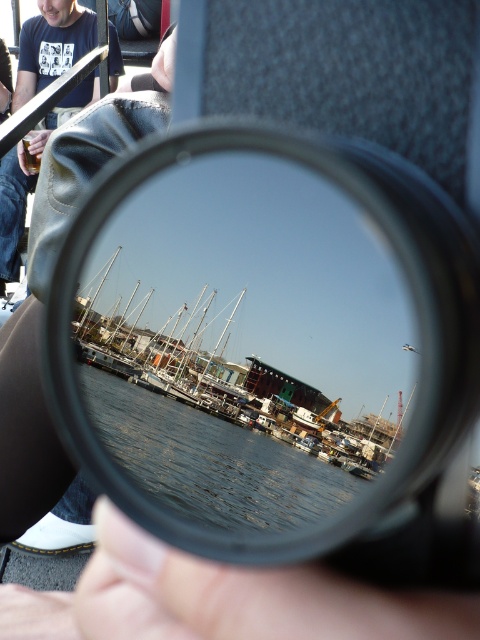
You are a photographer holding a camera with a circular lens. You notice a smooth skin hand at center and a clear water at center in your viewfinder. Which object is closer to the right edge of the circular lens?

The smooth skin hand at center is closer to the right edge of the circular lens because it is positioned to the right of the clear water at center.

You are an observer looking through the transparent plastic lens at center. You notice the clear water at center in your view. Which object is positioned to the right of the other?

The transparent plastic lens at center is to the right of clear water at center according to the description.